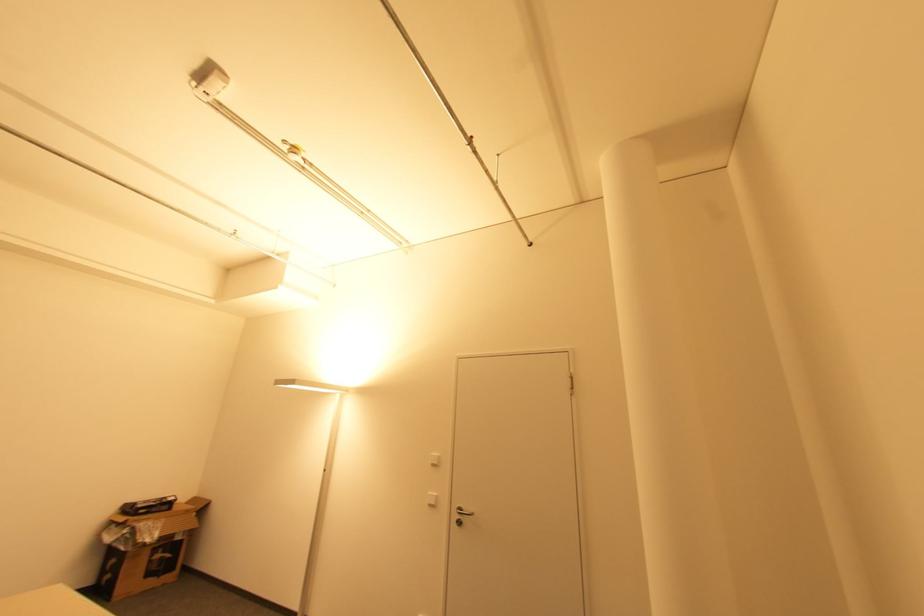
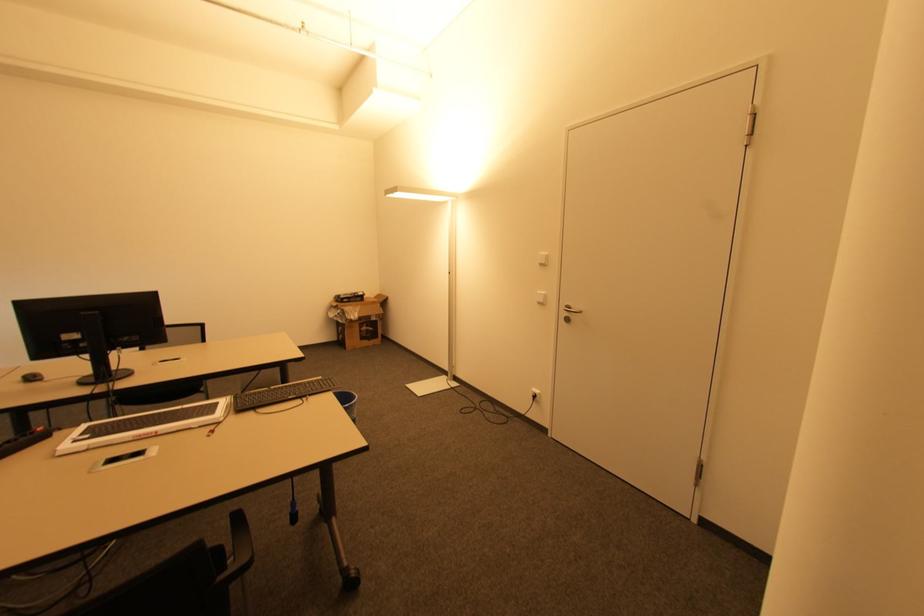
Locate, in the second image, the point that corresponds to the point at 433,506 in the first image.

(541, 302)